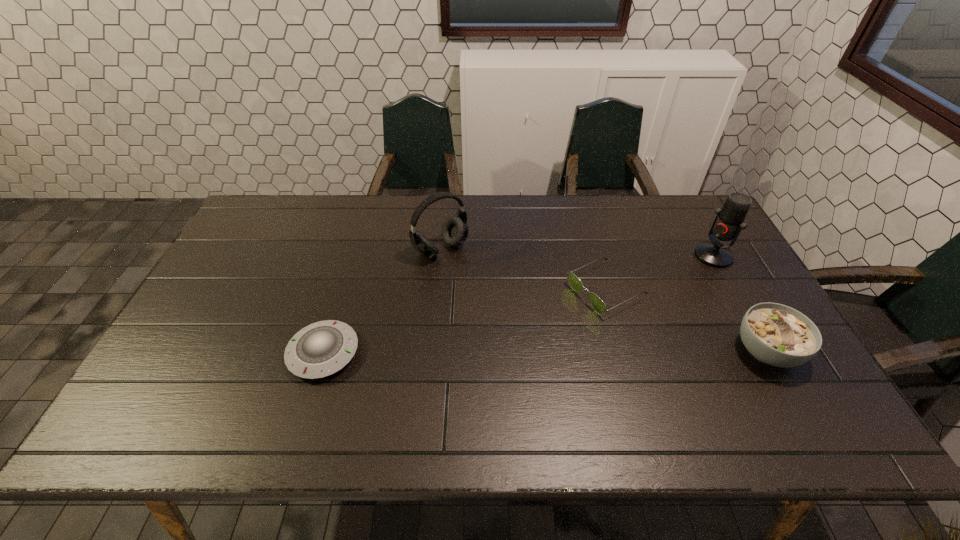
At what (x,y) coordinates should I click in order to perform the action: click on free location that satisfies the following two spatial constraints: 1. on the front side of the microphone; 2. on the left side of the fourth object from right to left. Please return your answer as a coordinate pair (x, y). Image resolution: width=960 pixels, height=540 pixels. Looking at the image, I should click on (440, 255).